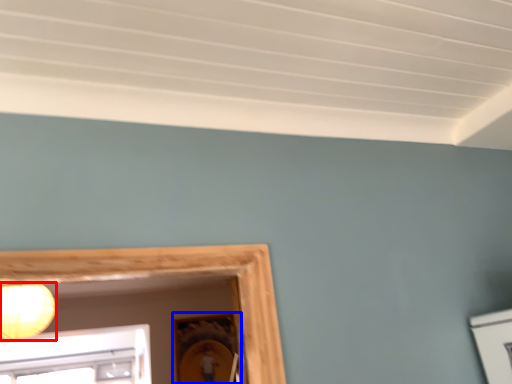
Question: Which point is further to the camera, lamp (highlighted by a red box) or picture frame (highlighted by a blue box)?

Choices:
 (A) lamp
 (B) picture frame

Answer: (B)